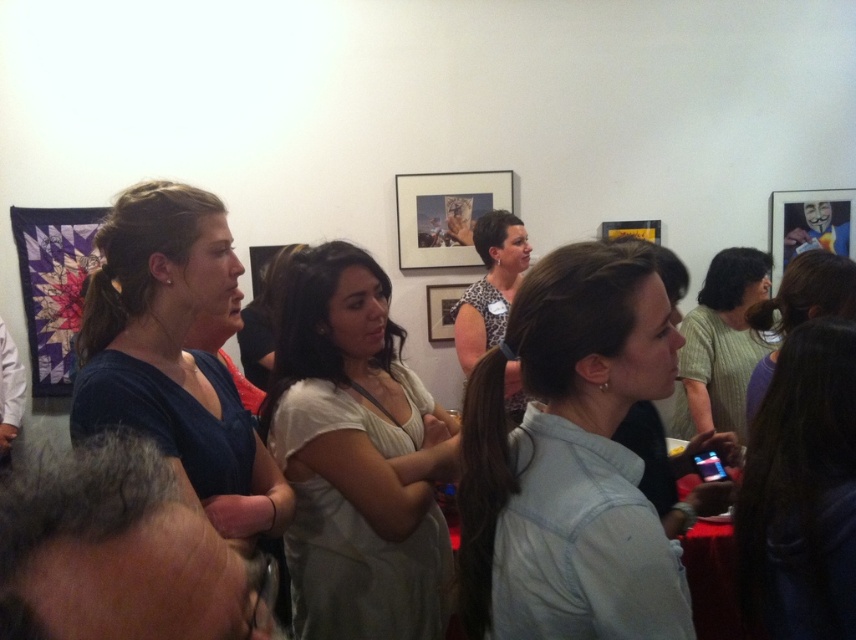
Who is taller, light blue denim shirt at center or blue matte shirt at center?

With more height is blue matte shirt at center.

Is point (483, 545) less distant than point (215, 449)?

Yes, point (483, 545) is in front of point (215, 449).

Find the location of `light blue denim shirt at center`. light blue denim shirt at center is located at coordinates (593, 342).

Is blue matte shirt at center positioned before leopard print blouse at center?

Yes, blue matte shirt at center is closer to the viewer.

Where is `blue matte shirt at center`? The width and height of the screenshot is (856, 640). blue matte shirt at center is located at coordinates (177, 360).

Between white cotton dress at center and blue matte shirt at center, which one is positioned higher?

Positioned higher is white cotton dress at center.

Looking at this image, can you confirm if white cotton dress at center is shorter than blue matte shirt at center?

Indeed, white cotton dress at center has a lesser height compared to blue matte shirt at center.

What do you see at coordinates (355, 458) in the screenshot?
I see `white cotton dress at center` at bounding box center [355, 458].

Where is `white cotton dress at center`? white cotton dress at center is located at coordinates (355, 458).